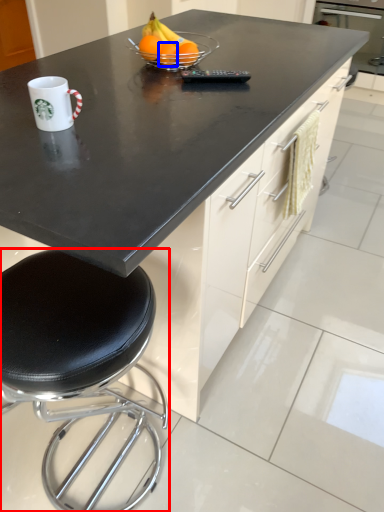
Question: Which point is closer to the camera, stool (highlighted by a red box) or orange (highlighted by a blue box)?

Choices:
 (A) stool
 (B) orange

Answer: (A)